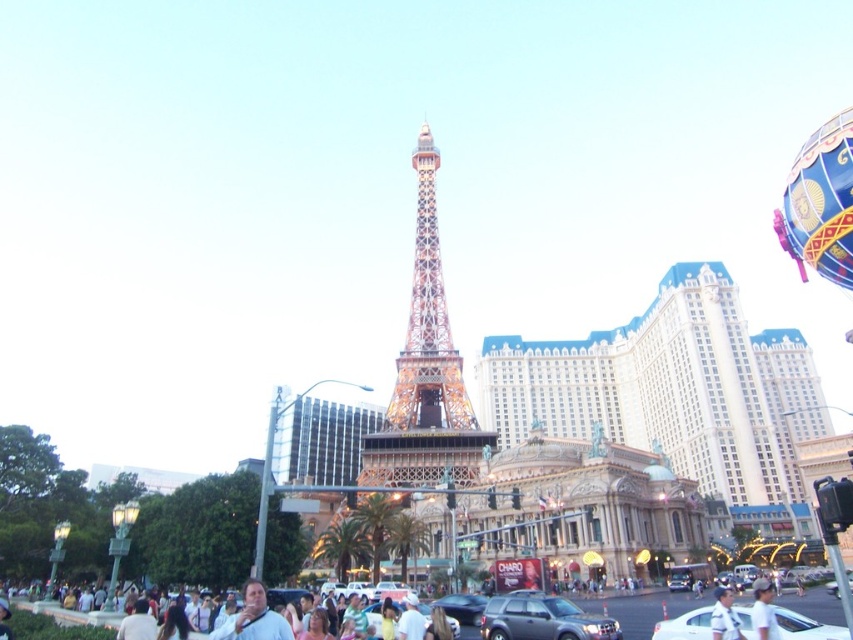
You are a tourist standing on the Las Vegas strip near the Eiffel Tower replica. You see a matte black suv at center and a white matte shirt at center. Which object is positioned more to the left?

The matte black suv at center is positioned more to the left than the white matte shirt at center.